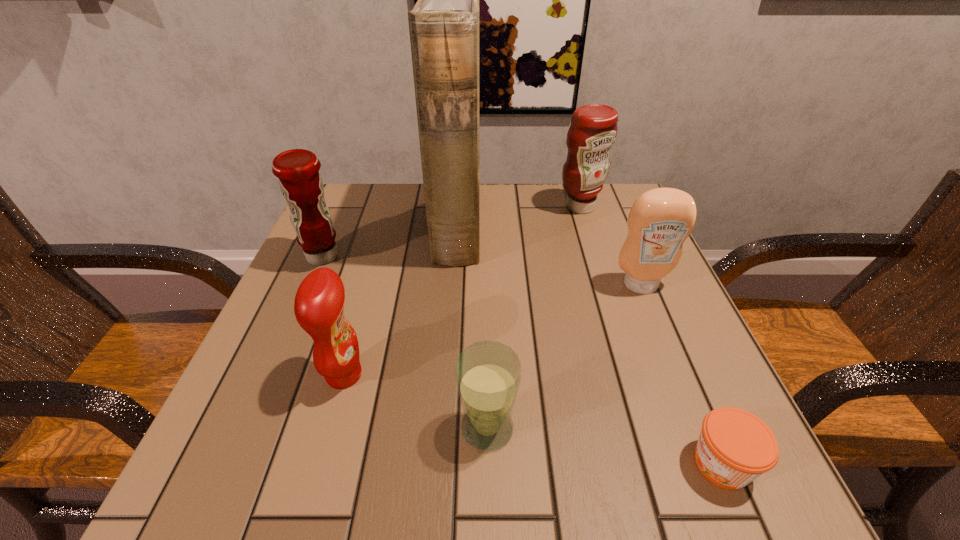
I want to click on phonebook, so click(x=444, y=24).

Find the location of a particular element. the farthest condiment is located at coordinates (593, 129).

You are a GUI agent. You are given a task and a screenshot of the screen. Output one action in this format:
    pyautogui.click(x=<x>, y=<y>)
    Task: Click on the leftmost condiment
    The width and height of the screenshot is (960, 540).
    Given the screenshot: What is the action you would take?
    pyautogui.click(x=300, y=181)

You are a GUI agent. You are given a task and a screenshot of the screen. Output one action in this format:
    pyautogui.click(x=<x>, y=<y>)
    Task: Click on the third nearest condiment
    
    Given the screenshot: What is the action you would take?
    pyautogui.click(x=300, y=181)

At what (x,y) coordinates should I click in order to perform the action: click on the fourth nearest object. Please return your answer as a coordinate pair (x, y). Looking at the image, I should click on (660, 220).

Identify the location of the nearest condiment. This screenshot has height=540, width=960. (319, 302).

Identify the location of the third condiment from right to left. (319, 302).

Identify the location of the sixth tallest object. The height and width of the screenshot is (540, 960). (488, 374).

Locate an element on the screen. This screenshot has width=960, height=540. the shortest object is located at coordinates (735, 447).

In order to click on vacant space located on the cover of the phonebook in this screenshot , I will do `click(543, 226)`.